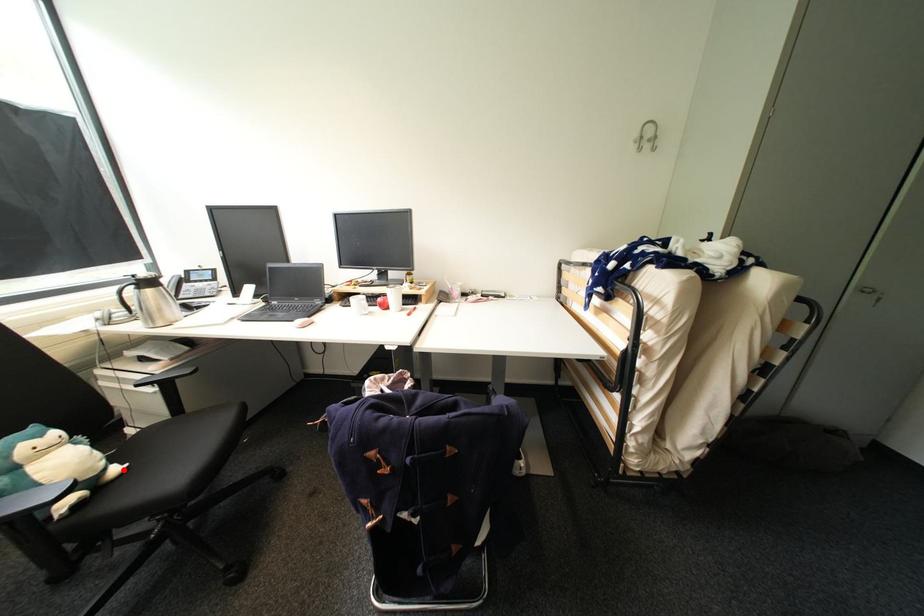
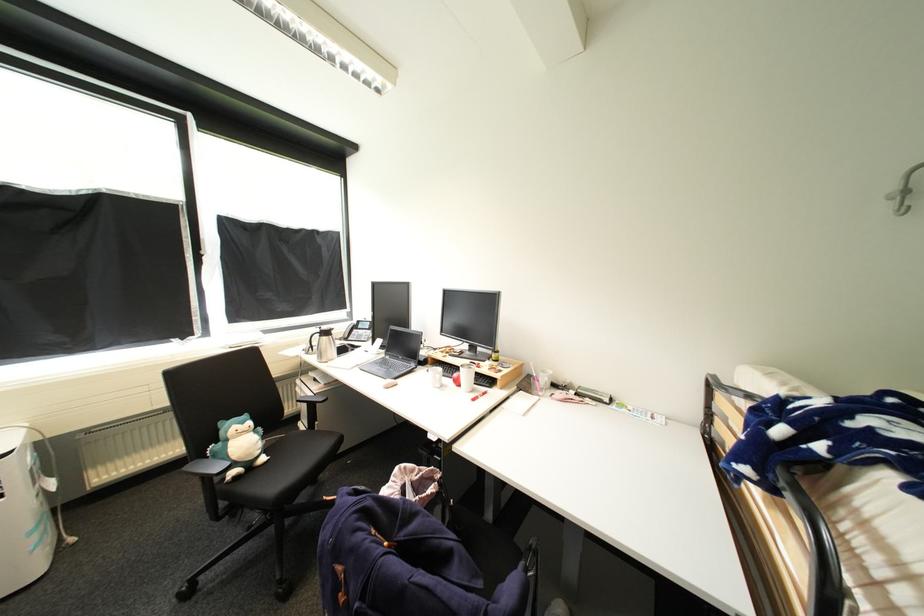
Question: A red point is marked in image1. In image2, is the corresponding 3D point closer to the camera or farther? Reply with the corresponding letter.

Choices:
 (A) The corresponding 3D point is closer.
 (B) The corresponding 3D point is farther.

Answer: (A)